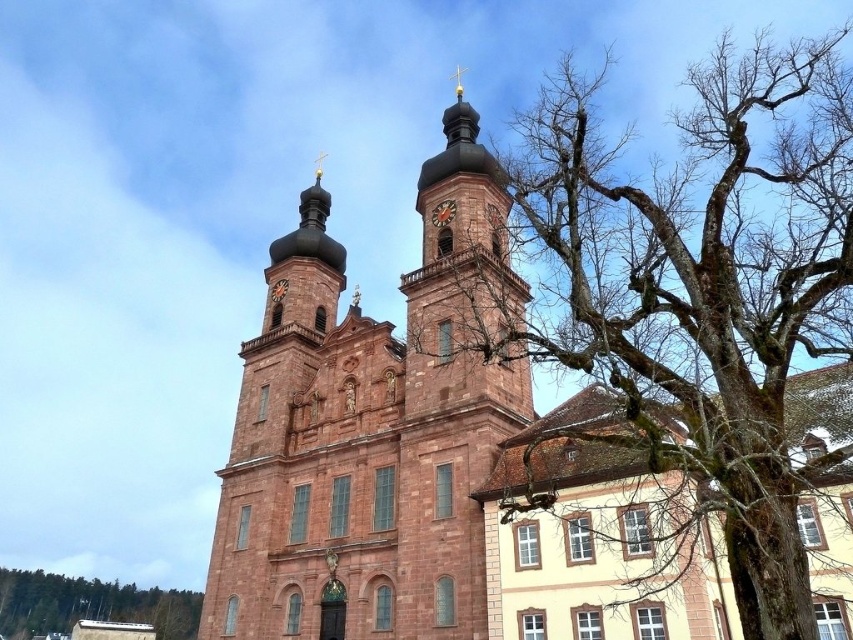
Question: Is reddish-brown stone tower at center closer to the viewer compared to bare wood tree at lower left?

Choices:
 (A) no
 (B) yes

Answer: (B)

Question: Which is farther from the bare wood tree at lower left?

Choices:
 (A) gold metallic clock at upper center
 (B) bare branches at upper right

Answer: (A)

Question: Is bare branches at upper right below bare wood tree at lower left?

Choices:
 (A) yes
 (B) no

Answer: (B)

Question: Estimate the real-world distances between objects in this image. Which object is closer to the bare wood tree at lower left?

Choices:
 (A) bare branches at upper right
 (B) reddish-brown stone tower at center

Answer: (B)

Question: Which object is closer to the camera taking this photo?

Choices:
 (A) bare branches at upper right
 (B) bare wood tree at lower left
 (C) gold metallic clock at upper center

Answer: (A)

Question: Does bare branches at upper right come in front of reddish-brown stone tower at center?

Choices:
 (A) no
 (B) yes

Answer: (B)